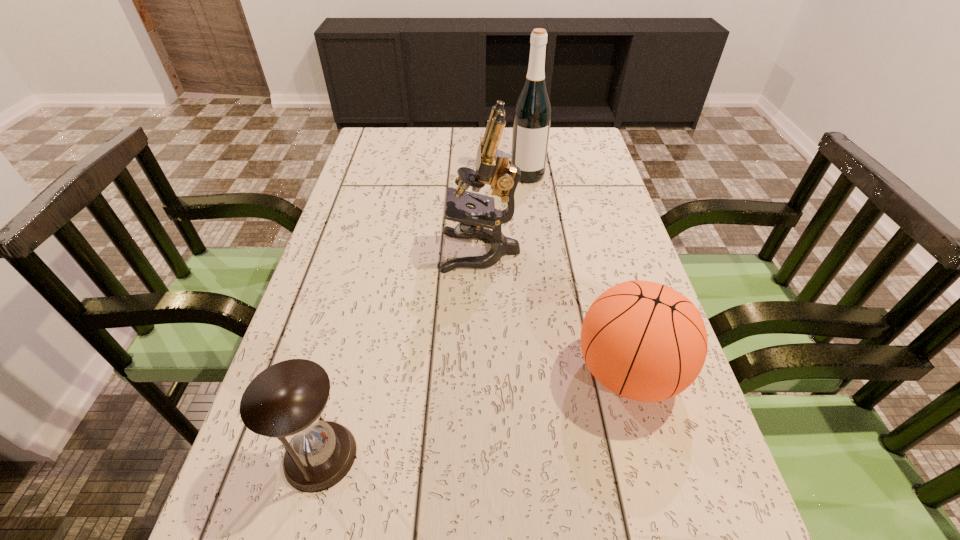
This screenshot has width=960, height=540. Identify the location of empty space that is in between the wine bottle and the basketball. (578, 273).

Where is `empty location between the basketball and the farthest object`? Image resolution: width=960 pixels, height=540 pixels. empty location between the basketball and the farthest object is located at coordinates (578, 273).

Find the location of a particular element. Image resolution: width=960 pixels, height=540 pixels. free space between the basketball and the leftmost object is located at coordinates pyautogui.click(x=474, y=414).

Select which object appears as the second closest to the third nearest object. Please provide its 2D coordinates. Your answer should be formatted as a tuple, i.e. [(x, y)], where the tuple contains the x and y coordinates of a point satisfying the conditions above.

[(532, 115)]

Locate which object ranks in proximity to the third nearest object. Please provide its 2D coordinates. Your answer should be formatted as a tuple, i.e. [(x, y)], where the tuple contains the x and y coordinates of a point satisfying the conditions above.

[(644, 341)]

Find the location of a particular element. This screenshot has height=540, width=960. free point that satisfies the following two spatial constraints: 1. on the label of the basketball; 2. on the left side of the wine bottle is located at coordinates (555, 372).

Locate an element on the screen. free spot that satisfies the following two spatial constraints: 1. on the label of the wine bottle; 2. on the left side of the basketball is located at coordinates (555, 372).

This screenshot has width=960, height=540. What are the coordinates of `vacant space that satisfies the following two spatial constraints: 1. at the eyepieces of the microscope; 2. on the front side of the leftmost object` in the screenshot? It's located at (482, 456).